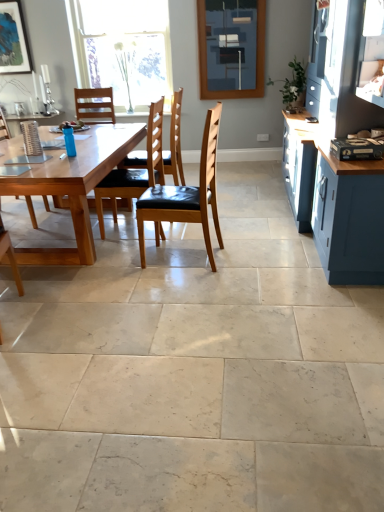
Where is `vacant area that lies in front of brown leather chair at center, placed as the fourth chair when sorted from left to right`? vacant area that lies in front of brown leather chair at center, placed as the fourth chair when sorted from left to right is located at coordinates (181, 285).